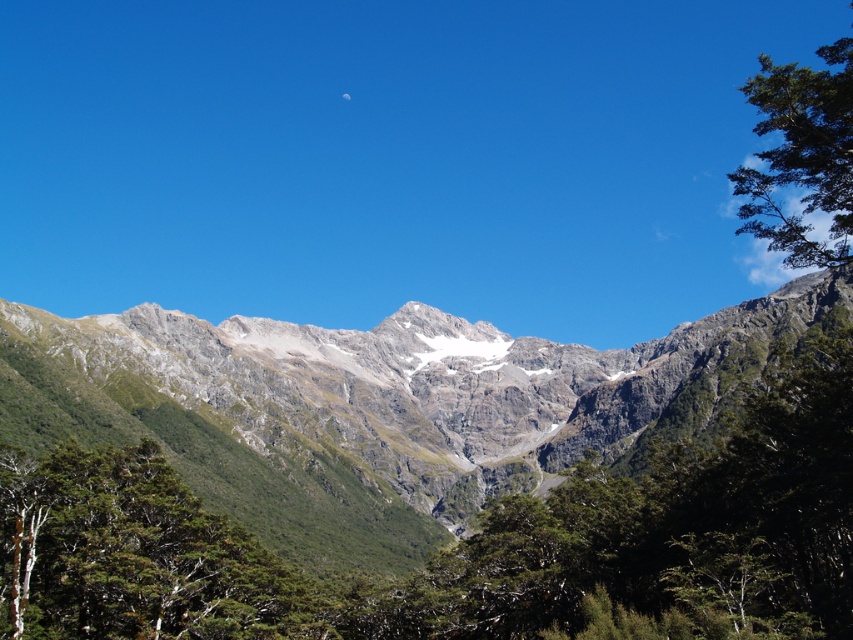
Is green leafy tree at lower left above green leafy tree at upper right?

No.

Between point (189, 518) and point (795, 166), which one is positioned behind?

Point (189, 518)

You are a GUI agent. You are given a task and a screenshot of the screen. Output one action in this format:
    pyautogui.click(x=<x>, y=<y>)
    Task: Click on the green leafy tree at lower left
    
    Given the screenshot: What is the action you would take?
    pyautogui.click(x=132, y=556)

Who is lower down, rugged granite mountain range at center or green leafy tree at lower left?

green leafy tree at lower left

The height and width of the screenshot is (640, 853). What do you see at coordinates (379, 408) in the screenshot? I see `rugged granite mountain range at center` at bounding box center [379, 408].

Between point (682, 328) and point (311, 616), which one is positioned in front?

Point (311, 616)

This screenshot has width=853, height=640. What are the coordinates of `rugged granite mountain range at center` in the screenshot? It's located at (379, 408).

Between point (244, 387) and point (827, 163), which one is positioned in front?

Point (827, 163) is in front.

Between rugged granite mountain range at center and green leafy tree at upper right, which one is positioned higher?

Positioned higher is green leafy tree at upper right.

Does point (90, 436) lie in front of point (805, 157)?

No, it is behind (805, 157).

Where is `rugged granite mountain range at center`? rugged granite mountain range at center is located at coordinates (379, 408).